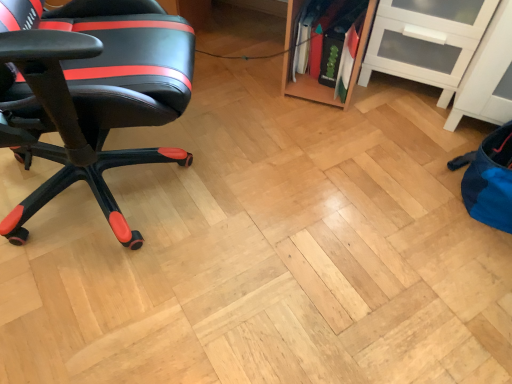
Question: Is white glossy cabinet at upper right to the right of black leather chair at left from the viewer's perspective?

Choices:
 (A) no
 (B) yes

Answer: (B)

Question: Is white glossy cabinet at upper right wider than black leather chair at left?

Choices:
 (A) yes
 (B) no

Answer: (B)

Question: Is white glossy cabinet at upper right far from black leather chair at left?

Choices:
 (A) yes
 (B) no

Answer: (A)

Question: Is white glossy cabinet at upper right directly adjacent to black leather chair at left?

Choices:
 (A) yes
 (B) no

Answer: (B)

Question: From the image's perspective, would you say white glossy cabinet at upper right is shown under black leather chair at left?

Choices:
 (A) yes
 (B) no

Answer: (B)

Question: Is white glossy cabinet at upper right further to the viewer compared to black leather chair at left?

Choices:
 (A) yes
 (B) no

Answer: (A)

Question: Are black leather chair at left and white glossy cabinet at upper right located far from each other?

Choices:
 (A) yes
 (B) no

Answer: (A)

Question: From the image's perspective, is black leather chair at left on white glossy cabinet at upper right?

Choices:
 (A) yes
 (B) no

Answer: (B)

Question: Is black leather chair at left located outside white glossy cabinet at upper right?

Choices:
 (A) yes
 (B) no

Answer: (A)

Question: Can you confirm if black leather chair at left is shorter than white glossy cabinet at upper right?

Choices:
 (A) yes
 (B) no

Answer: (B)

Question: Does black leather chair at left touch white glossy cabinet at upper right?

Choices:
 (A) no
 (B) yes

Answer: (A)

Question: Is black leather chair at left wider than white glossy cabinet at upper right?

Choices:
 (A) yes
 (B) no

Answer: (A)

Question: From a real-world perspective, is white glossy cabinet at upper right positioned above or below black leather chair at left?

Choices:
 (A) above
 (B) below

Answer: (B)